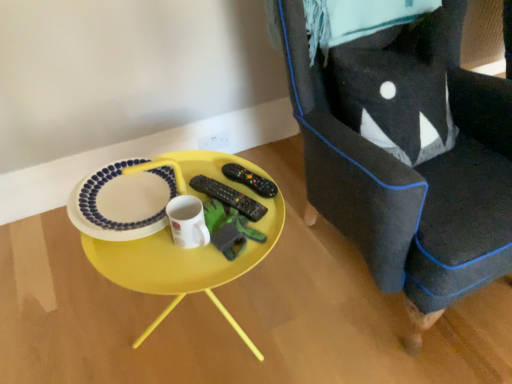
Image resolution: width=512 pixels, height=384 pixels. Find the location of `free region on the left part of yellow plastic table at center`. free region on the left part of yellow plastic table at center is located at coordinates 66,319.